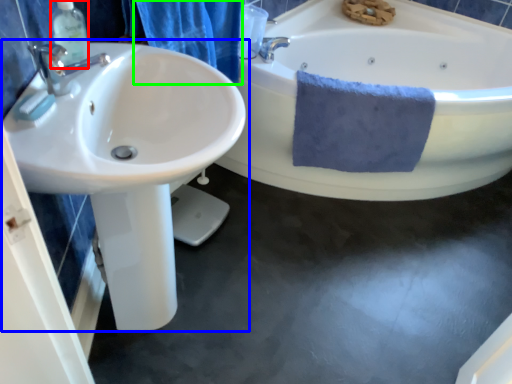
Question: Which is nearer to the soap dispenser (highlighted by a red box)? sink (highlighted by a blue box) or shower curtain (highlighted by a green box).

Choices:
 (A) sink
 (B) shower curtain

Answer: (A)